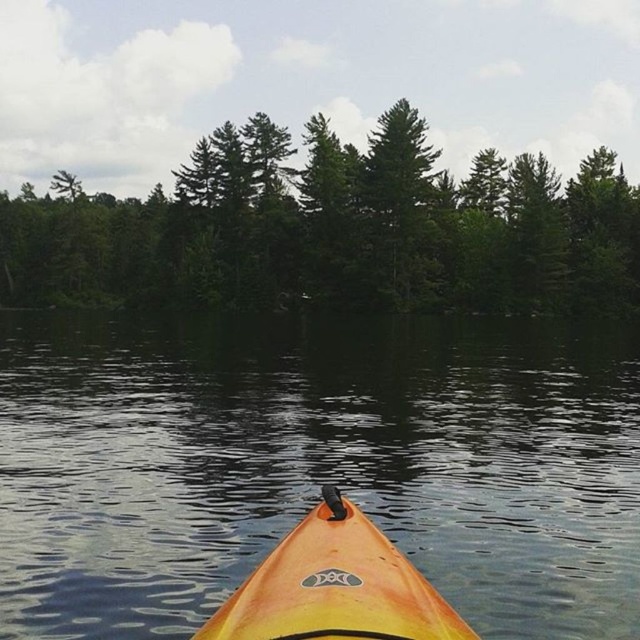
Question: Which point is closer to the camera?

Choices:
 (A) (476, 483)
 (B) (502, 273)

Answer: (A)

Question: Does orange/yellow kayak at lower center lie behind green matte tree at upper center?

Choices:
 (A) no
 (B) yes

Answer: (A)

Question: Which point is farther to the camera?

Choices:
 (A) orange matte kayak at lower center
 (B) green matte tree at upper center
 (C) orange/yellow kayak at lower center

Answer: (B)

Question: Is orange/yellow kayak at lower center below green matte tree at upper center?

Choices:
 (A) no
 (B) yes

Answer: (B)

Question: Which point is closer to the camera?

Choices:
 (A) orange matte kayak at lower center
 (B) orange/yellow kayak at lower center
 (C) green matte tree at upper center

Answer: (A)

Question: Does orange/yellow kayak at lower center have a lesser width compared to green matte tree at upper center?

Choices:
 (A) no
 (B) yes

Answer: (B)